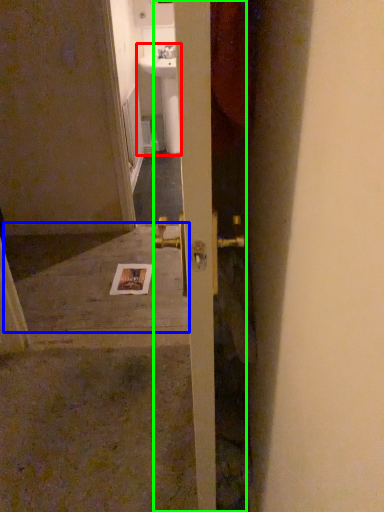
Question: Based on their relative distances, which object is farther from sink (highlighted by a red box)? Choose from concrete (highlighted by a blue box) and door (highlighted by a green box).

Choices:
 (A) concrete
 (B) door

Answer: (B)